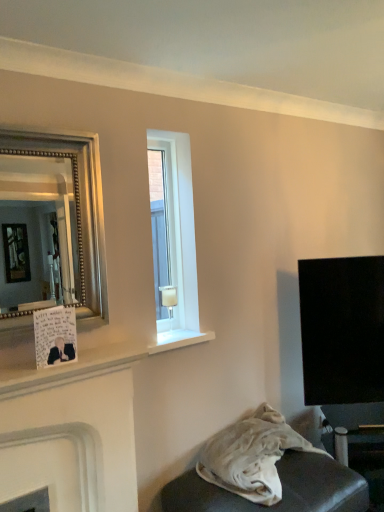
Question: Considering the relative positions of white matte fireplace at lower left and silver beaded mirror at left in the image provided, is white matte fireplace at lower left to the left or to the right of silver beaded mirror at left?

Choices:
 (A) left
 (B) right

Answer: (B)

Question: From the image's perspective, is white matte fireplace at lower left above or below silver beaded mirror at left?

Choices:
 (A) below
 (B) above

Answer: (A)

Question: Considering the real-world distances, which object is closest to the clear glass window at center?

Choices:
 (A) white fabric at lower right
 (B) white matte fireplace at lower left
 (C) silver beaded mirror at left

Answer: (B)

Question: Based on their relative distances, which object is farther from the clear glass window at center?

Choices:
 (A) white fabric at lower right
 (B) white matte fireplace at lower left
 (C) silver beaded mirror at left

Answer: (C)